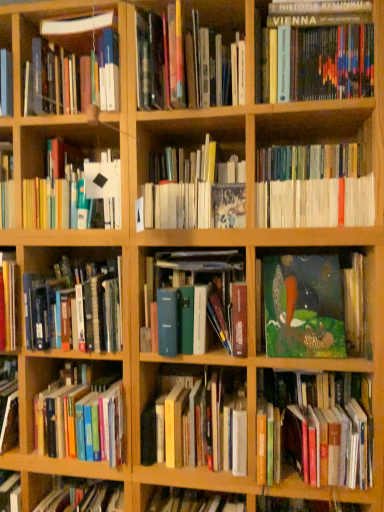
Question: Looking at their shapes, would you say blue hardcover book at center, the fourth book in the bottom-to-top sequence, is wider or thinner than hardcover book at center, positioned as the eleventh book in top-to-bottom order?

Choices:
 (A) thin
 (B) wide

Answer: (B)

Question: Is point (188, 292) positioned closer to the camera than point (147, 451)?

Choices:
 (A) farther
 (B) closer

Answer: (B)

Question: Considering the real-world distances, which object is closest to the white matte book at center, the 6th book when ordered from top to bottom?

Choices:
 (A) hardcover books at left, which is the 6th book in bottom-to-top order
 (B) hardcover book at upper center, which is the 1th book from top to bottom
 (C) hardcover books at lower left, which ranks as the 1th book in bottom-to-top order
 (D) hardcover book at upper right, which is the third book from top to bottom
 (E) white matte book at upper right, the fourth book in the top-to-bottom sequence

Answer: (E)

Question: Which object is the farthest from the white matte book at upper left, which appears as the eighth book when ordered from the bottom?

Choices:
 (A) blue hardcover book at center, which ranks as the ninth book in top-to-bottom order
 (B) hardcover books at left, placed as the seventh book when sorted from top to bottom
 (C) white matte book at center, the 6th book when ordered from top to bottom
 (D) hardcover books at lower left, which ranks as the twelfth book in top-to-bottom order
 (E) white matte book at upper right, which ranks as the ninth book in bottom-to-top order

Answer: (D)